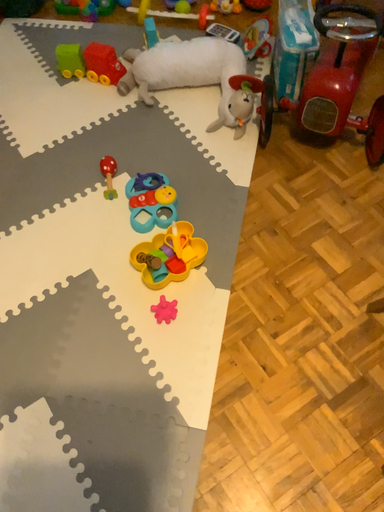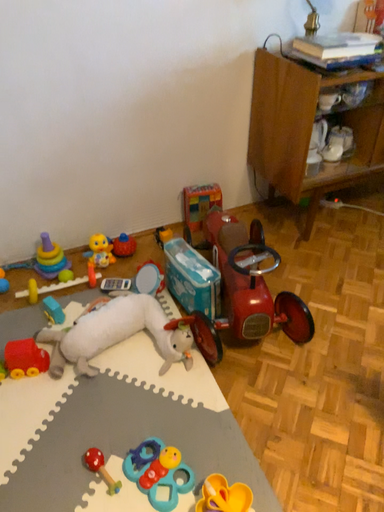
Question: How did the camera likely rotate when shooting the video?

Choices:
 (A) rotated left
 (B) rotated right

Answer: (B)